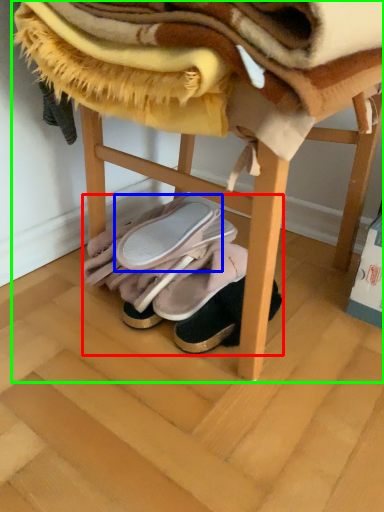
Question: Considering the real-world distances, which object is farthest from footwear (highlighted by a red box)? footwear (highlighted by a blue box) or furniture (highlighted by a green box)?

Choices:
 (A) footwear
 (B) furniture

Answer: (B)